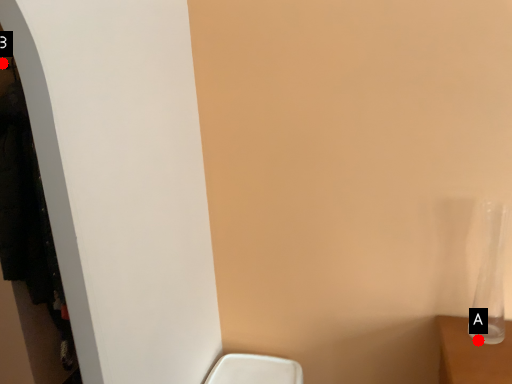
Question: Two points are circled on the image, labeled by A and B beside each circle. Which point appears closest to the camera in this image?

Choices:
 (A) A is closer
 (B) B is closer

Answer: (A)